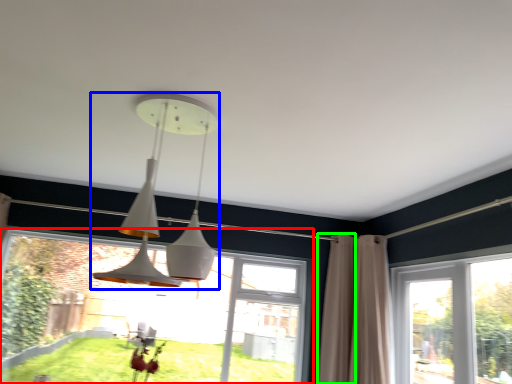
Question: Estimate the real-world distances between objects in this image. Which object is farther from window (highlighted by a red box), lamp (highlighted by a blue box) or curtain (highlighted by a green box)?

Choices:
 (A) lamp
 (B) curtain

Answer: (A)